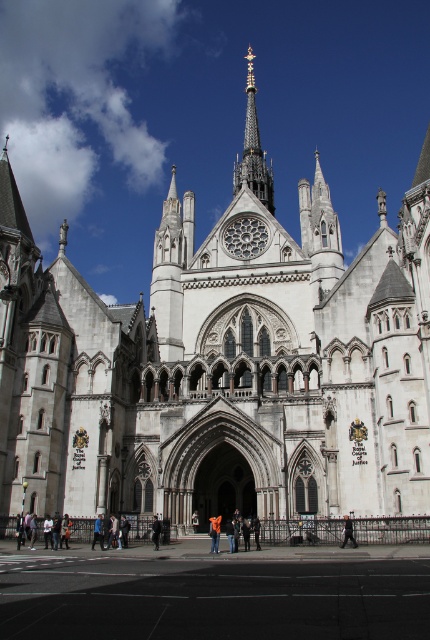
Is polished steel spire at upper center closer to camera compared to black fabric person at center?

No, polished steel spire at upper center is behind black fabric person at center.

Is point (245, 172) closer to viewer compared to point (156, 534)?

No, it is not.

Where is `polished steel spire at upper center`? polished steel spire at upper center is located at coordinates (252, 150).

In the scene shown: Between blue fabric jacket at lower left and black fabric person at center, which one appears on the left side from the viewer's perspective?

Positioned to the left is blue fabric jacket at lower left.

Where is `blue fabric jacket at lower left`? Image resolution: width=430 pixels, height=640 pixels. blue fabric jacket at lower left is located at coordinates (98, 531).

Which is more to the right, polished steel spire at upper center or dark gray jacket at center?

From the viewer's perspective, dark gray jacket at center appears more on the right side.

Is polished steel spire at upper center positioned behind dark gray jacket at center?

Yes, it is.

Between point (249, 156) and point (344, 532), which one is positioned behind?

The point (249, 156) is more distant.

Where is `polished steel spire at upper center`? This screenshot has height=640, width=430. polished steel spire at upper center is located at coordinates (252, 150).